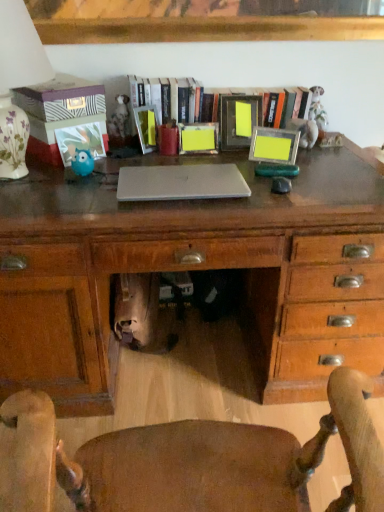
Identify the location of spots to the right of matte blue owl at left, which is the 1th picture frame from left to right. This screenshot has height=512, width=384. (122, 164).